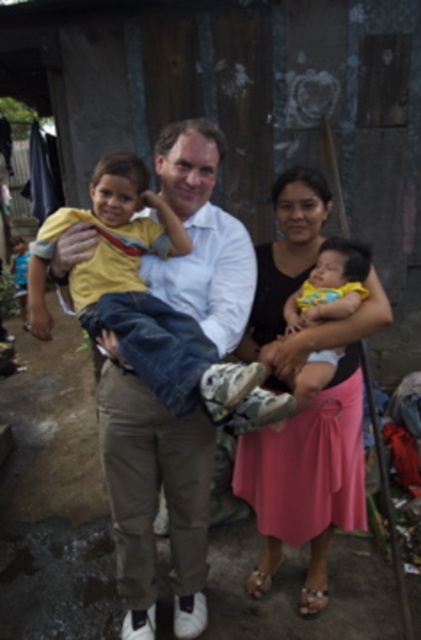
You are a photographer setting up for a family photo. You notice the yellow matte shirt at center and the yellow fabric baby at center. Which object would you need to adjust your camera focus on first if you want to ensure both are in focus, considering their sizes?

The yellow matte shirt at center has a larger size compared to the yellow fabric baby at center, so you should focus on the larger object first to ensure depth of field covers both.

You are a photographer trying to capture a closeup of the khaki pants at center and the matte yellow shirt at center. Which one should you focus on first to ensure it is in sharp focus?

You should focus on the khaki pants at center first because it is closer to you than the matte yellow shirt at center, so focusing on the closer object ensures it will be in sharp focus.

You are standing at the point labeled point (146,304). Looking around, you see the yellow matte shirt at center. What is the closest object to your current position?

The closest object to your current position at point (146,304) is the yellow matte shirt at center as the point directly indicates its location.